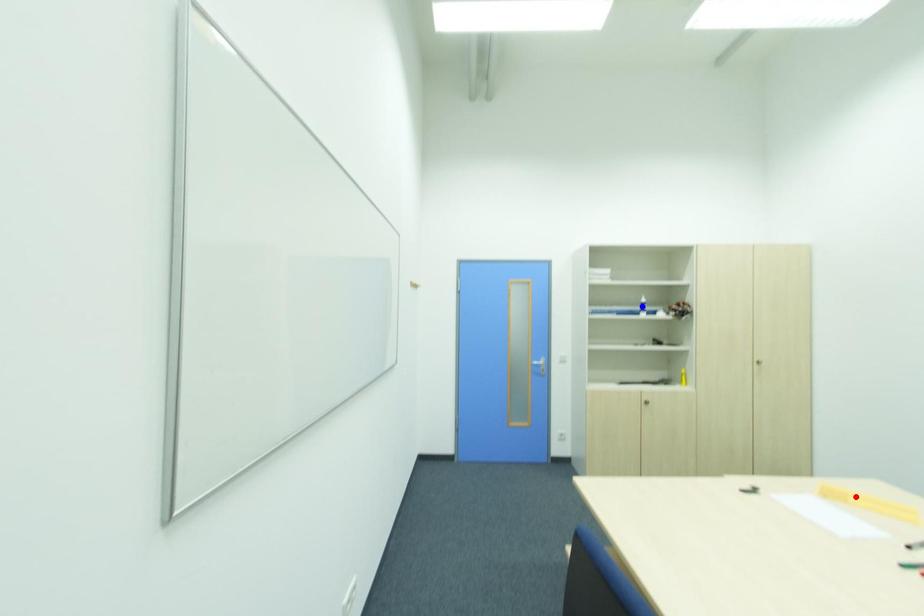
Question: In the image, two points are highlighted. Which point is nearer to the camera? Reply with the corresponding letter.

Choices:
 (A) blue point
 (B) red point

Answer: (B)